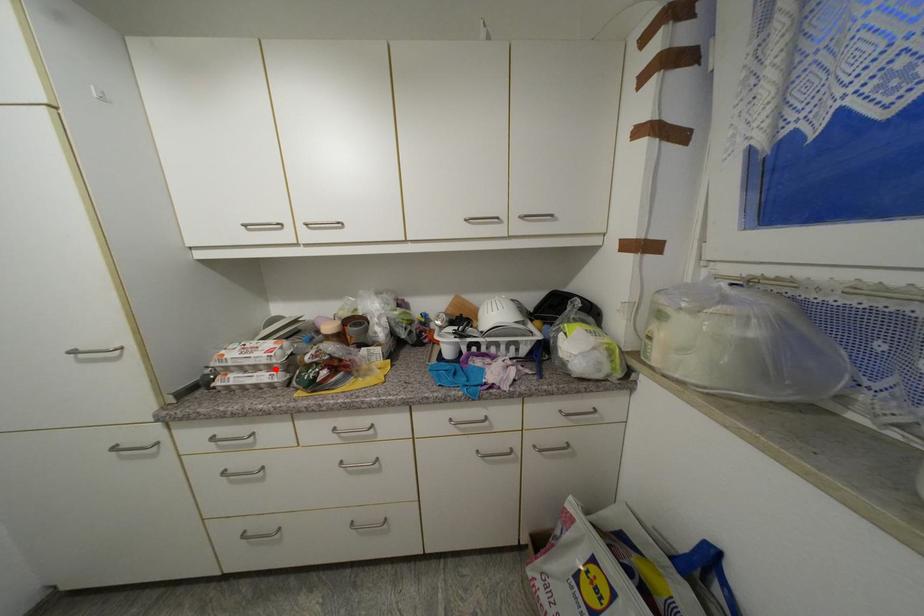
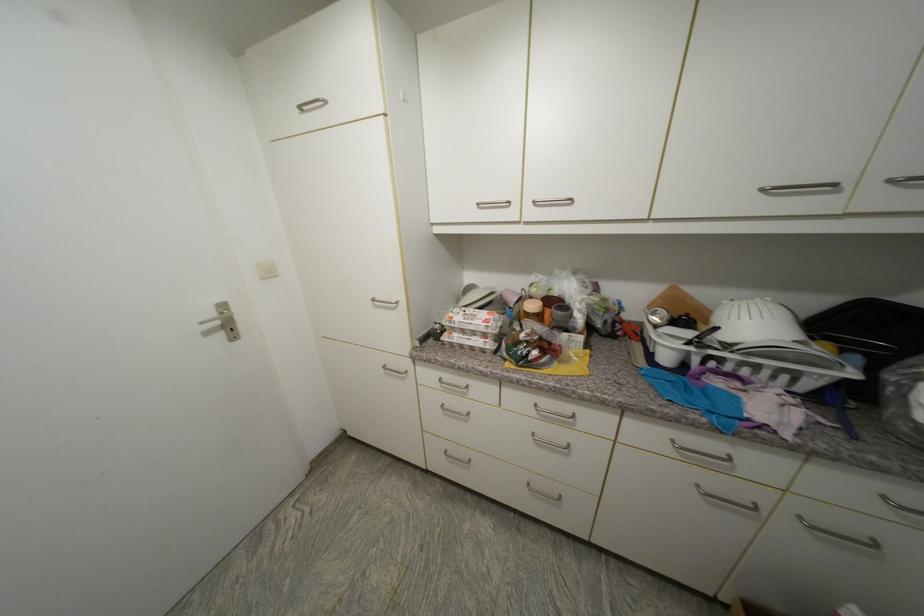
Find the pixel in the second image that matches the highlighted location in the first image.

(490, 337)